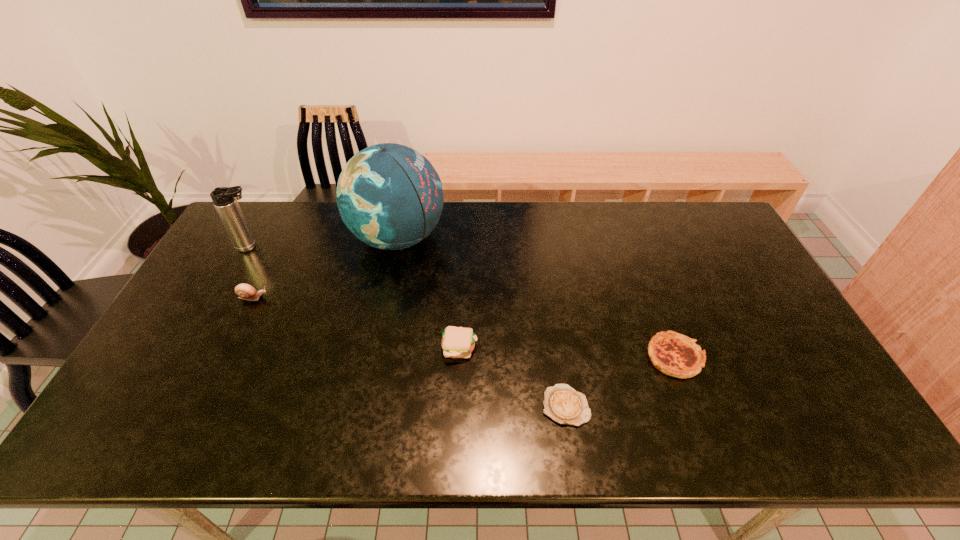
Where is `vacant point that satisfies the following two spatial constraints: 1. on the front-facing side of the second shortest object; 2. on the right side of the escargot`? Image resolution: width=960 pixels, height=540 pixels. vacant point that satisfies the following two spatial constraints: 1. on the front-facing side of the second shortest object; 2. on the right side of the escargot is located at coordinates (225, 357).

Locate an element on the screen. This screenshot has height=540, width=960. free location that satisfies the following two spatial constraints: 1. on the front-facing side of the third farthest object; 2. on the back side of the right quiche is located at coordinates (225, 357).

You are a GUI agent. You are given a task and a screenshot of the screen. Output one action in this format:
    pyautogui.click(x=<x>, y=<y>)
    Task: Click on the vacant area that satisfies the following two spatial constraints: 1. on the back side of the right quiche; 2. on the front-facing side of the escargot
    
    Given the screenshot: What is the action you would take?
    pyautogui.click(x=653, y=298)

At what (x,y) coordinates should I click in order to perform the action: click on free space that satisfies the following two spatial constraints: 1. on the front-facing side of the farther quiche; 2. on the right side of the fourth nearest object. Please return your answer as a coordinate pair (x, y). The width and height of the screenshot is (960, 540). Looking at the image, I should click on (225, 357).

Identify the location of free spot that satisfies the following two spatial constraints: 1. on the front-facing side of the escargot; 2. on the right side of the nearer quiche. (201, 406).

Identify the location of free location that satisfies the following two spatial constraints: 1. on the front-facing side of the escargot; 2. on the right side of the patty. (228, 348).